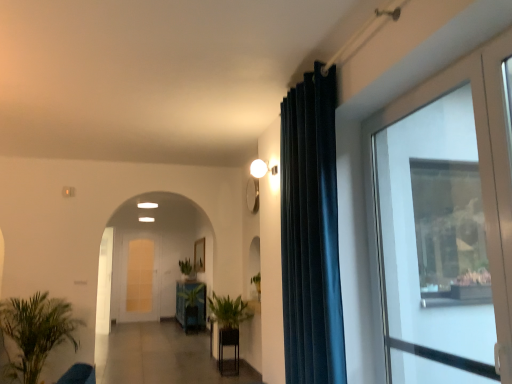
Question: From a real-world perspective, is green glossy plant pot at center, acting as the 1th furniture starting from the left, physically above dark blue velvet curtain at center?

Choices:
 (A) no
 (B) yes

Answer: (A)

Question: Can you confirm if green glossy plant pot at center, marked as the first furniture in a back-to-front arrangement, is thinner than dark blue velvet curtain at center?

Choices:
 (A) yes
 (B) no

Answer: (B)

Question: Is green glossy plant pot at center, the second furniture from the front, surrounding dark blue velvet curtain at center?

Choices:
 (A) no
 (B) yes

Answer: (A)

Question: Is green glossy plant pot at center, acting as the 1th furniture starting from the left, looking in the opposite direction of dark blue velvet curtain at center?

Choices:
 (A) no
 (B) yes

Answer: (A)

Question: Is green glossy plant pot at center, acting as the 1th furniture starting from the left, closer to camera compared to dark blue velvet curtain at center?

Choices:
 (A) no
 (B) yes

Answer: (A)

Question: Is green leafy plant at center, acting as the second houseplant starting from the left, situated inside green glossy plant pot at center, marked as the first furniture in a back-to-front arrangement, or outside?

Choices:
 (A) inside
 (B) outside

Answer: (B)

Question: From a real-world perspective, relative to green glossy plant pot at center, the second furniture from the front, is green leafy plant at center, arranged as the second houseplant when viewed from the right, vertically above or below?

Choices:
 (A) below
 (B) above

Answer: (B)

Question: From the image's perspective, relative to green glossy plant pot at center, marked as the first furniture in a back-to-front arrangement, is green leafy plant at center, acting as the second houseplant starting from the left, above or below?

Choices:
 (A) above
 (B) below

Answer: (A)

Question: Considering the positions of point (234, 301) and point (194, 324), is point (234, 301) closer or farther from the camera than point (194, 324)?

Choices:
 (A) closer
 (B) farther

Answer: (A)

Question: Based on their positions, is white glass screen door at center, which is the 2th screen door in front-to-back order, located to the left or right of wooden frame at center?

Choices:
 (A) left
 (B) right

Answer: (A)

Question: From the image's perspective, relative to wooden frame at center, is white glass screen door at center, which is the 1th screen door from back to front, above or below?

Choices:
 (A) above
 (B) below

Answer: (B)

Question: From a real-world perspective, is white glass screen door at center, which is the 2th screen door in front-to-back order, positioned above or below wooden frame at center?

Choices:
 (A) above
 (B) below

Answer: (B)

Question: In terms of height, does white glass screen door at center, which is the 1th screen door from back to front, look taller or shorter compared to wooden frame at center?

Choices:
 (A) short
 (B) tall

Answer: (B)

Question: Does point (330, 357) appear closer or farther from the camera than point (196, 240)?

Choices:
 (A) farther
 (B) closer

Answer: (B)

Question: Based on their positions, is dark blue velvet curtain at center located to the left or right of wooden frame at center?

Choices:
 (A) left
 (B) right

Answer: (B)